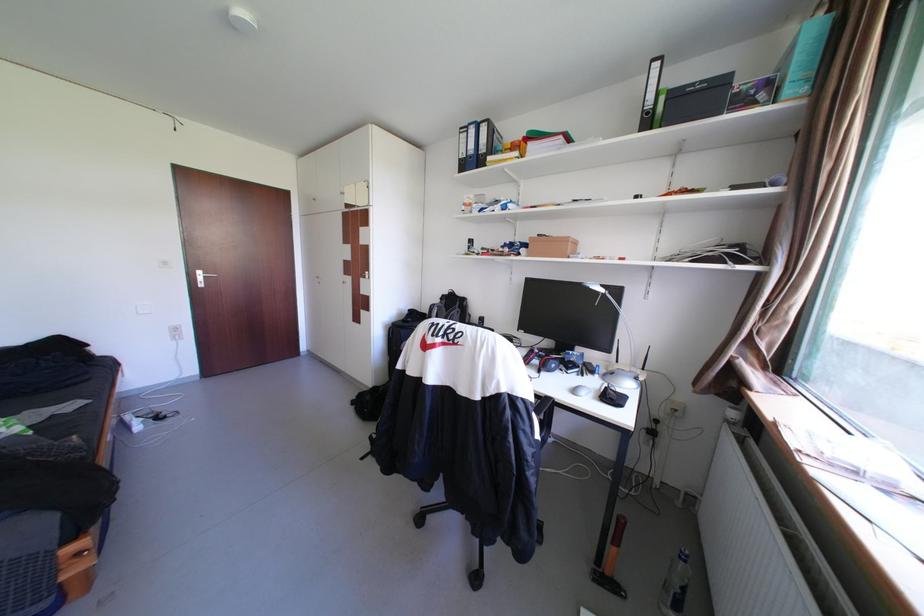
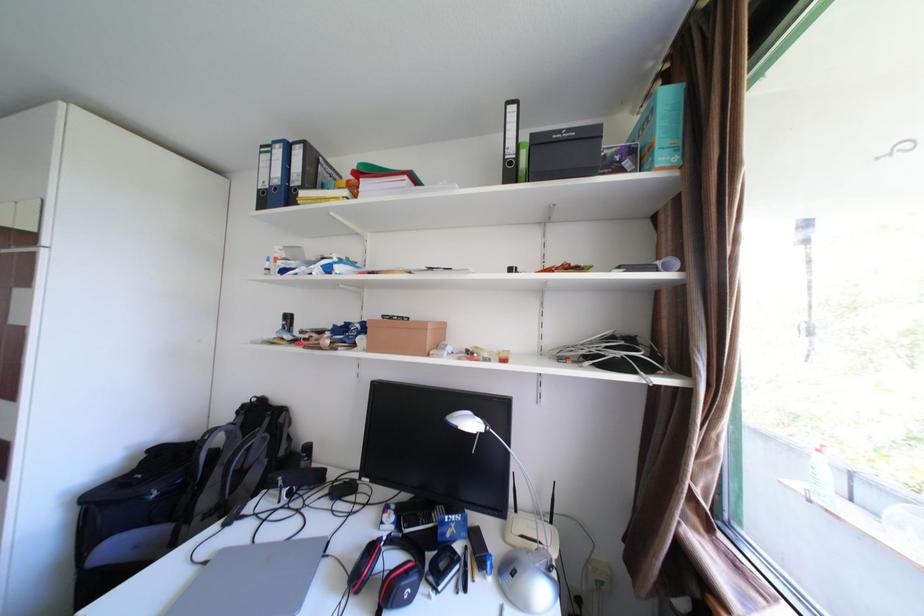
Question: The camera is either moving clockwise (left) or counter-clockwise (right) around the object. The first image is from the beginning of the video and the second image is from the end. Is the camera moving left or right when shooting the video?

Choices:
 (A) Left
 (B) Right

Answer: (A)